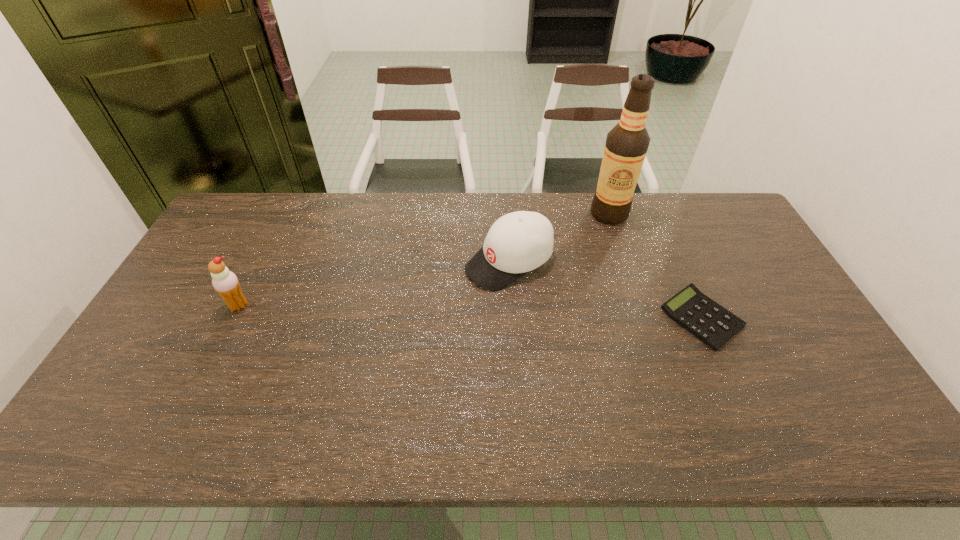
Locate an element on the screen. icecream is located at coordinates (225, 282).

Where is `the leftmost object`? the leftmost object is located at coordinates (225, 282).

Locate an element on the screen. The image size is (960, 540). calculator is located at coordinates (708, 321).

Locate an element on the screen. baseball cap is located at coordinates (518, 242).

At what (x,y) coordinates should I click in order to perform the action: click on the third tallest object. Please return your answer as a coordinate pair (x, y). The height and width of the screenshot is (540, 960). Looking at the image, I should click on (518, 242).

Locate an element on the screen. Image resolution: width=960 pixels, height=540 pixels. the farthest object is located at coordinates (626, 145).

Image resolution: width=960 pixels, height=540 pixels. I want to click on the tallest object, so click(626, 145).

You are a GUI agent. You are given a task and a screenshot of the screen. Output one action in this format:
    pyautogui.click(x=<x>, y=<y>)
    Task: Click on the vacant space located at the front with a straw on the third shortest object
    This screenshot has width=960, height=540.
    Given the screenshot: What is the action you would take?
    pyautogui.click(x=203, y=379)

Locate an element on the screen. free region located on the front of the calculator is located at coordinates (734, 393).

Where is `free spot located on the front-facing side of the baseball cap`? free spot located on the front-facing side of the baseball cap is located at coordinates (368, 338).